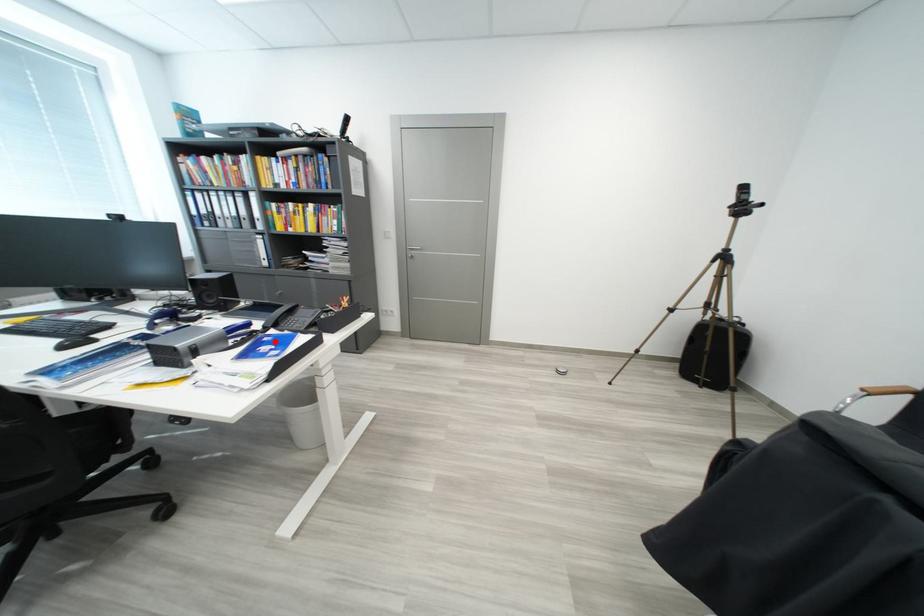
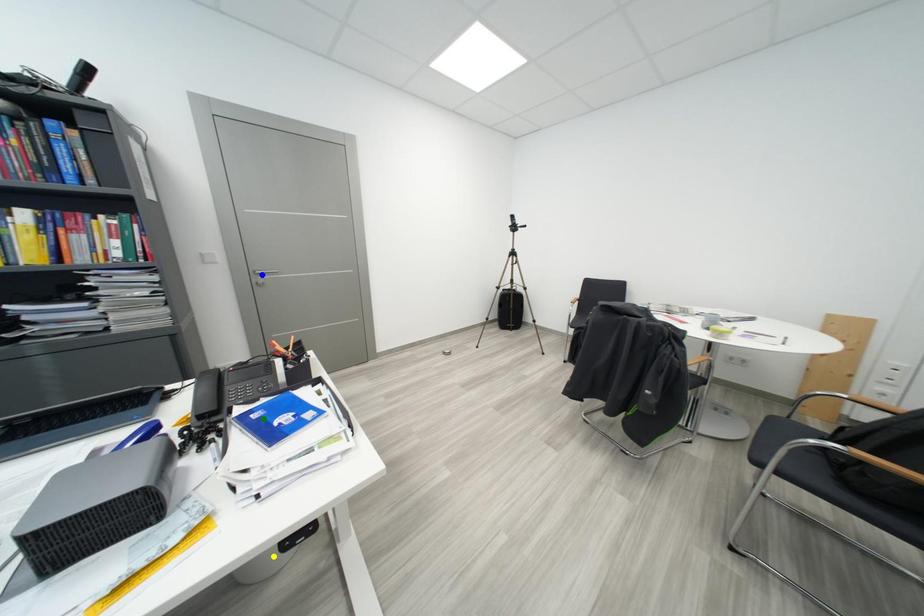
Question: I am providing you with two images of the same scene from different viewpoints. A red point is marked on the first image. You are given multiple points on the second image. In image 2, which mark is for the same physical point as the one in image 1?

Choices:
 (A) green point
 (B) yellow point
 (C) blue point

Answer: (A)